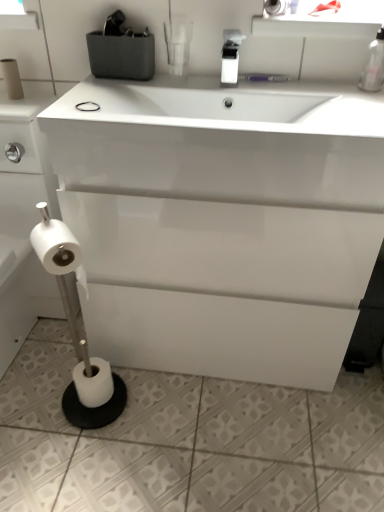
Where is `space that is in front of transparent glass spray bottle at upper right, positioned as the second bottle in left-to-right order`? The image size is (384, 512). space that is in front of transparent glass spray bottle at upper right, positioned as the second bottle in left-to-right order is located at coordinates (362, 105).